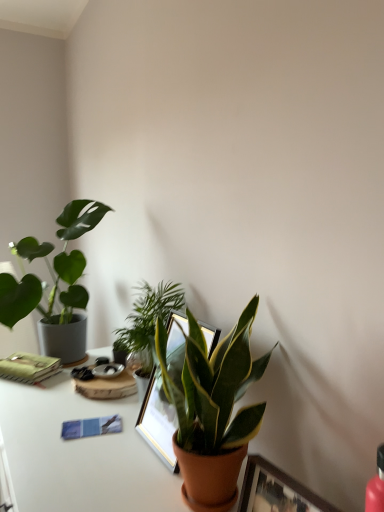
This screenshot has width=384, height=512. I want to click on free space above green matte notebook at left (from a real-world perspective), so click(23, 359).